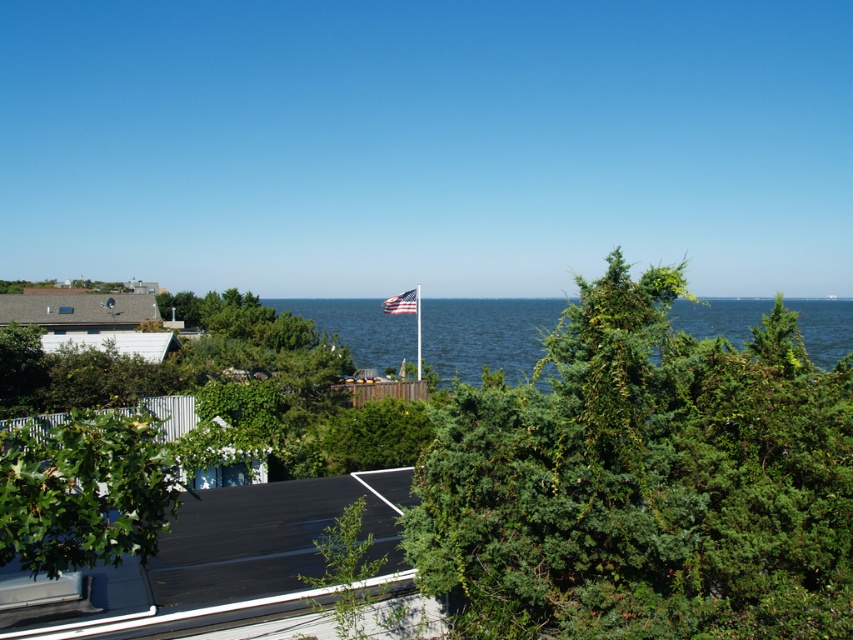
Question: Which object is closer to the camera taking this photo?

Choices:
 (A) blue water at center
 (B) green textured tree at center

Answer: (B)

Question: Which object is the farthest from the green textured tree at center?

Choices:
 (A) american flag at center
 (B) blue water at center

Answer: (B)

Question: Is green textured tree at center to the left of american flag at center from the viewer's perspective?

Choices:
 (A) no
 (B) yes

Answer: (A)

Question: Does green textured tree at center have a lesser width compared to blue water at center?

Choices:
 (A) yes
 (B) no

Answer: (A)

Question: Which of the following is the farthest from the observer?

Choices:
 (A) american flag at center
 (B) blue water at center
 (C) green textured tree at center

Answer: (A)

Question: Does green textured tree at center have a greater width compared to american flag at center?

Choices:
 (A) yes
 (B) no

Answer: (B)